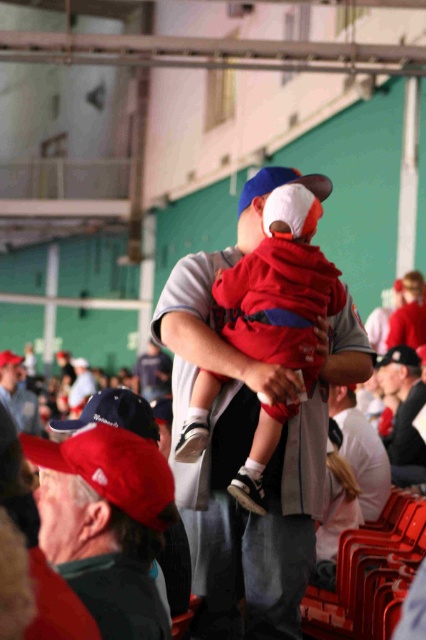
Question: Which of the following is the closest to the observer?

Choices:
 (A) (373, 452)
 (B) (285, 179)
 (C) (414, 458)
 (D) (14, 356)

Answer: (B)

Question: Among these points, which one is nearest to the camera?

Choices:
 (A) (160, 330)
 (B) (296, 269)
 (C) (244, 208)
 (D) (368, 470)

Answer: (B)

Question: Is the position of matte gray jacket at lower left less distant than that of white matte baseball cap at center?

Choices:
 (A) yes
 (B) no

Answer: (B)

Question: From the image, what is the correct spatial relationship of red fleece baby at center in relation to matte gray jacket at center?

Choices:
 (A) left
 (B) right

Answer: (A)

Question: Does red fleece baby at center appear on the left side of red fabric cap at lower left?

Choices:
 (A) yes
 (B) no

Answer: (B)

Question: Estimate the real-world distances between objects in this image. Which object is farther from the matte gray jacket at lower left?

Choices:
 (A) white matte baseball cap at center
 (B) matte gray jacket at center

Answer: (A)